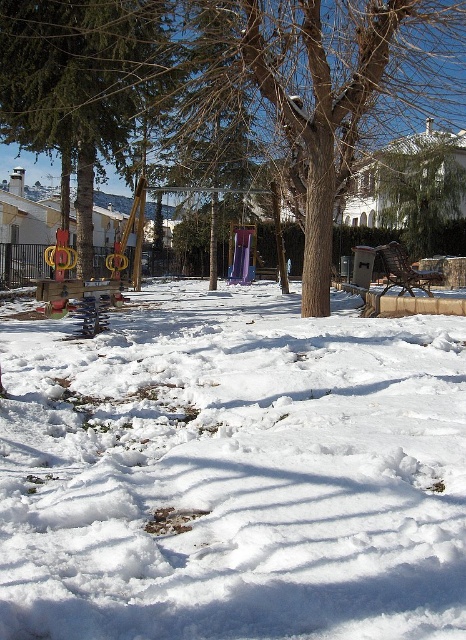
You are a snowman builder and want to create a snowman using the white fluffy snow at center and the brown wood tree at center. Which object can you use to make the snowman?

The white fluffy snow at center can be used to make the snowman because it is made of snow, while the brown wood tree at center is a tree and not suitable for building a snowman.